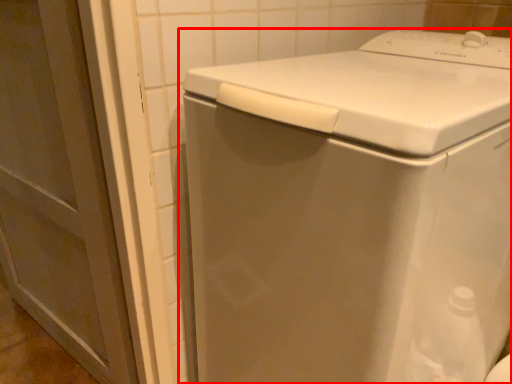
Question: From the image's perspective, considering the relative positions of washing machine (annotated by the red box) and screen door in the image provided, where is washing machine (annotated by the red box) located with respect to the staircase?

Choices:
 (A) below
 (B) above

Answer: (A)